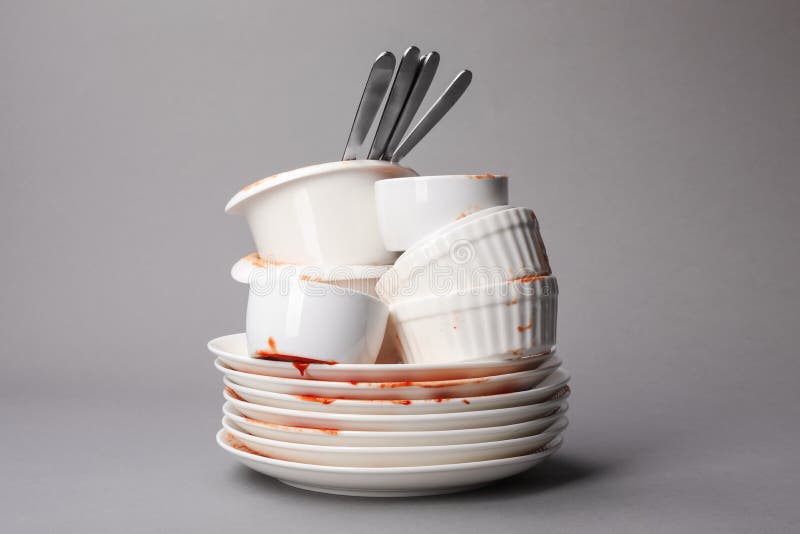
At what (x,y) coordinates should I click in order to perform the action: click on silverware. Please return your answer as a coordinate pair (x, y). The image size is (800, 534). Looking at the image, I should click on (366, 111), (388, 116), (406, 113), (422, 121).